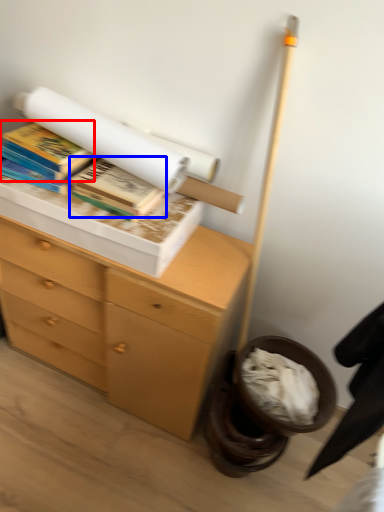
Question: Among these objects, which one is nearest to the camera, book (highlighted by a red box) or book (highlighted by a blue box)?

Choices:
 (A) book
 (B) book

Answer: (B)